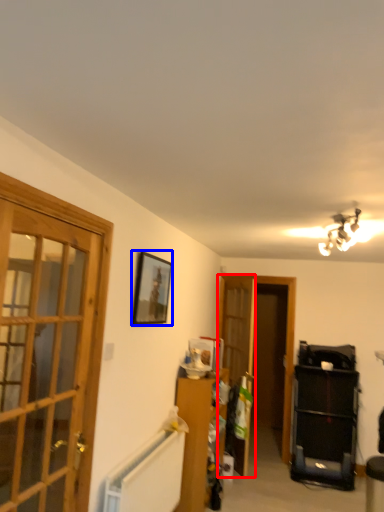
Question: Which of the following is the farthest to the observer, screen door (highlighted by a red box) or picture frame (highlighted by a blue box)?

Choices:
 (A) screen door
 (B) picture frame

Answer: (A)